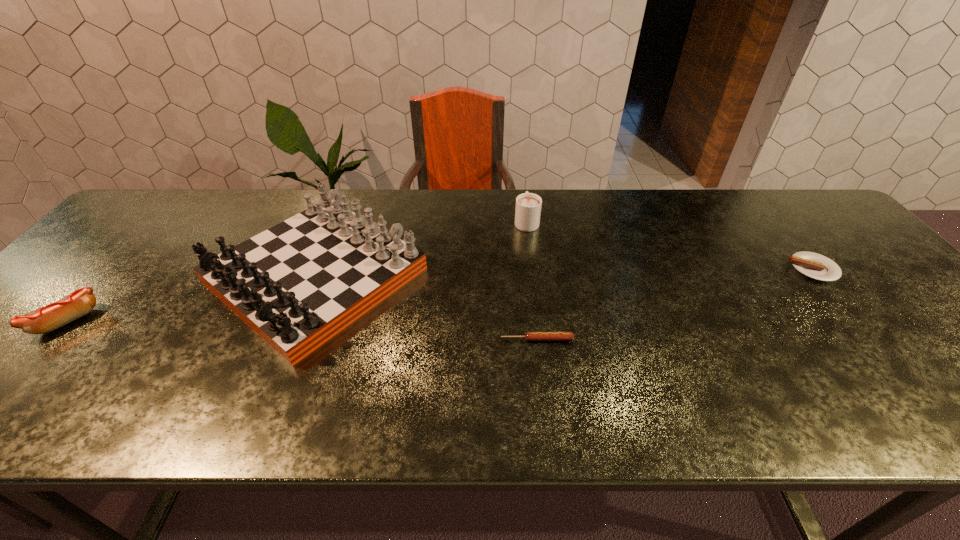
The height and width of the screenshot is (540, 960). I want to click on vacant region located on the side with the handle of the fourth shortest object, so click(x=522, y=190).

Locate an element on the screen. This screenshot has height=540, width=960. free space located 0.070m on the side with the handle of the fourth shortest object is located at coordinates (523, 198).

Where is `vacant area situated on the side with the handle of the fourth shortest object`? The image size is (960, 540). vacant area situated on the side with the handle of the fourth shortest object is located at coordinates (523, 198).

I want to click on vacant space situated on the back of the leftmost sausage, so click(132, 249).

What are the coordinates of `free region located 0.320m on the left of the rightmost sausage` in the screenshot? It's located at (666, 269).

Find the location of a particular element. This screenshot has width=960, height=540. vacant space positioned 0.310m on the right of the shortest sausage is located at coordinates (712, 339).

Locate an element on the screen. Image resolution: width=960 pixels, height=540 pixels. gameboard present at the far edge is located at coordinates [297, 284].

Find the location of a particular element. The image size is (960, 540). cappuccino present at the far edge is located at coordinates (528, 205).

Where is `object that is at the left edge`? The width and height of the screenshot is (960, 540). object that is at the left edge is located at coordinates (77, 304).

This screenshot has height=540, width=960. In order to click on object present at the right edge in this screenshot , I will do `click(816, 266)`.